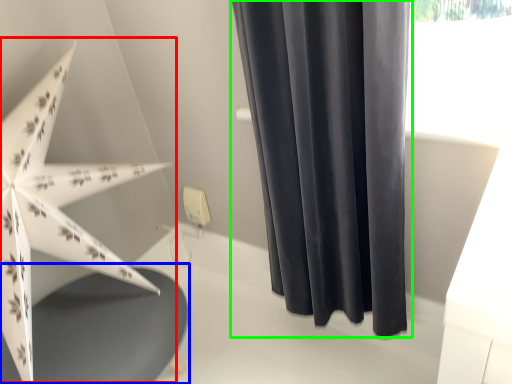
Question: Considering the real-world distances, which object is farthest from umbrella (highlighted by a red box)? round table (highlighted by a blue box) or curtain (highlighted by a green box)?

Choices:
 (A) round table
 (B) curtain

Answer: (B)